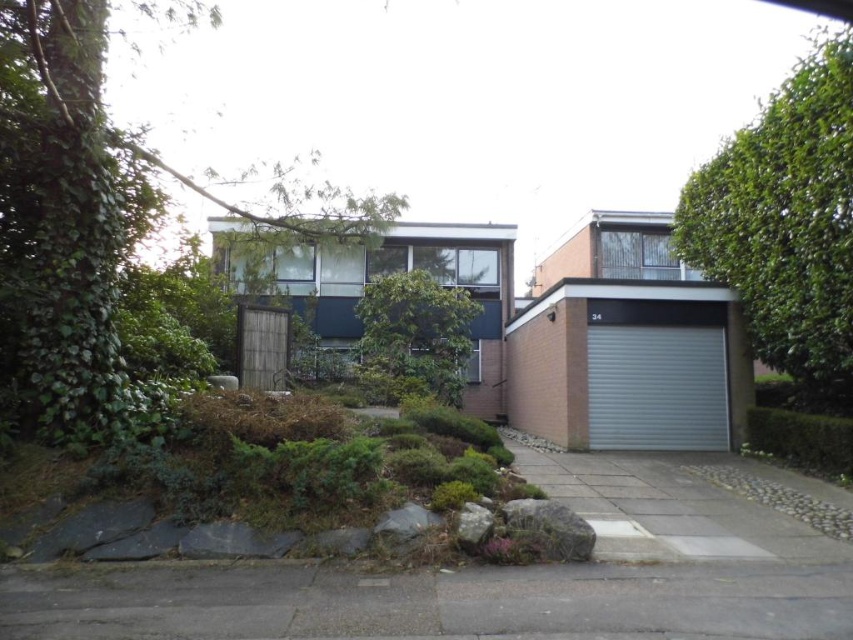
Question: Can you confirm if metallic silver garage at lower right is positioned below gray metallic garage door at lower right?

Choices:
 (A) no
 (B) yes

Answer: (A)

Question: Is gray concrete driveway at lower center wider than gray metallic garage door at lower right?

Choices:
 (A) yes
 (B) no

Answer: (A)

Question: Does metallic silver garage at lower right have a lesser width compared to brick garage at center?

Choices:
 (A) no
 (B) yes

Answer: (B)

Question: Which object is farther from the camera taking this photo?

Choices:
 (A) metallic silver garage at lower right
 (B) brick garage at center
 (C) gray metallic garage door at lower right
 (D) gray concrete driveway at lower center

Answer: (A)

Question: Which object is positioned closest to the brick garage at center?

Choices:
 (A) gray concrete driveway at lower center
 (B) gray metallic garage door at lower right

Answer: (B)

Question: Which object appears farthest from the camera in this image?

Choices:
 (A) gray metallic garage door at lower right
 (B) metallic silver garage at lower right
 (C) brick garage at center

Answer: (B)